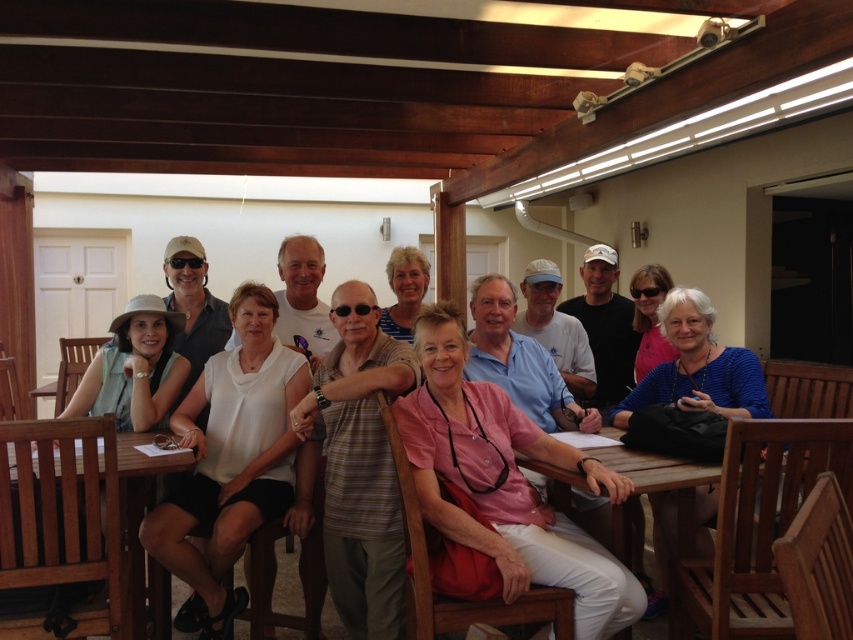
You are planning to place a large centerpiece on the teak wood table at lower left. Given its current position at coordinates point 0.809, 0.080, can you confirm if there is enough space on the table to accommodate it without obstructing the view of the attendees?

The teak wood table at lower left is located at point (67,516), but the provided information does not specify the table dimensions or the size of the centerpiece. Therefore, it is uncertain if there is sufficient space. Consider checking the table size or adjusting the centerpiece dimensions.

You are a server carrying a tray of drinks and need to move from the teak wood table at lower left to the wooden table at center. Is there enough space between them for you to pass through comfortably?

The distance between the teak wood table at lower left and the wooden table at center is 4.93 feet, which is sufficient for a server to comfortably pass through with a tray of drinks.